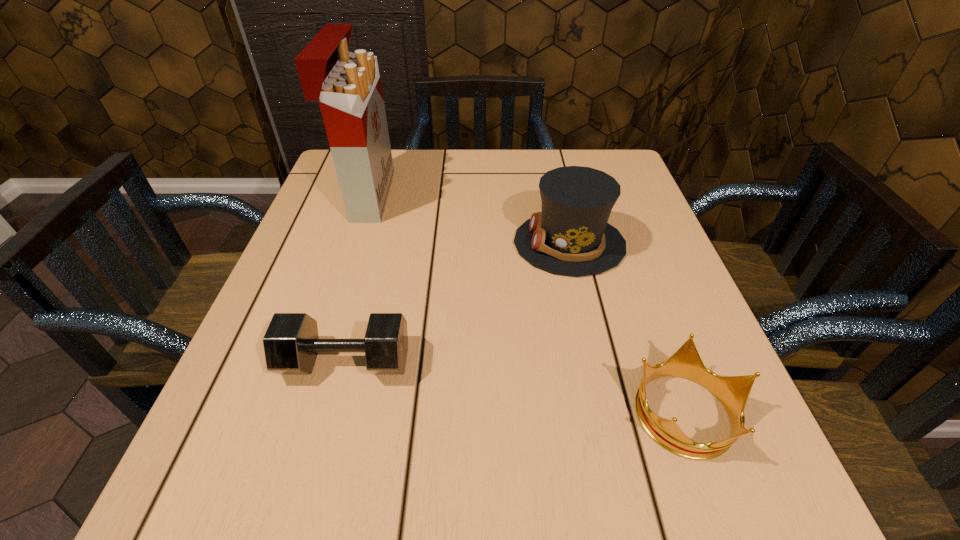
In the image, there is a desktop. Where is `blank space at the left edge`? This screenshot has height=540, width=960. blank space at the left edge is located at coordinates tap(339, 222).

Image resolution: width=960 pixels, height=540 pixels. I want to click on free space at the right edge, so click(x=636, y=378).

This screenshot has width=960, height=540. What are the coordinates of `free spot at the near left corner of the desktop` in the screenshot? It's located at (227, 508).

Image resolution: width=960 pixels, height=540 pixels. I want to click on free space at the far right corner of the desktop, so click(x=603, y=160).

Where is `free space between the dumbbell and the cigarette case`? free space between the dumbbell and the cigarette case is located at coordinates (357, 279).

Where is `empty space between the dress hat and the dumbbell`? empty space between the dress hat and the dumbbell is located at coordinates (458, 302).

Locate an element on the screen. The height and width of the screenshot is (540, 960). free space between the dumbbell and the crown is located at coordinates (516, 386).

Where is `vacant area that lies between the dumbbell and the crown`? vacant area that lies between the dumbbell and the crown is located at coordinates (516, 386).

At what (x,y) coordinates should I click in order to perform the action: click on free space between the crown and the dumbbell. Please return your answer as a coordinate pair (x, y). Looking at the image, I should click on (516, 386).

Where is `vacant area between the crown and the third shortest object`? This screenshot has height=540, width=960. vacant area between the crown and the third shortest object is located at coordinates (627, 327).